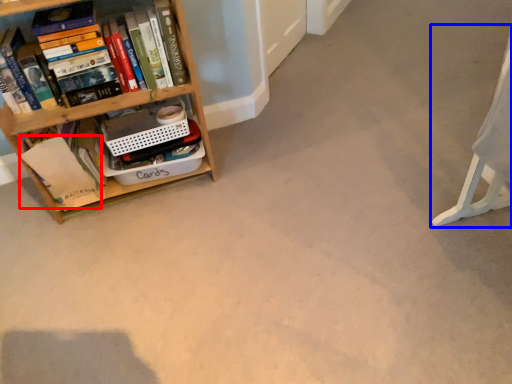
Question: Which point is closer to the camera, paperback book (highlighted by a red box) or swivel chair (highlighted by a blue box)?

Choices:
 (A) paperback book
 (B) swivel chair

Answer: (B)